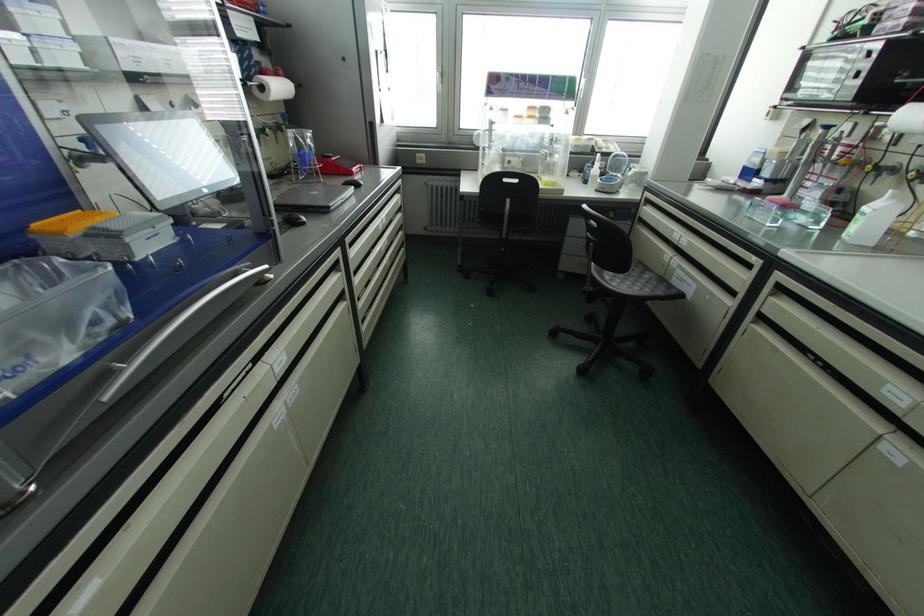
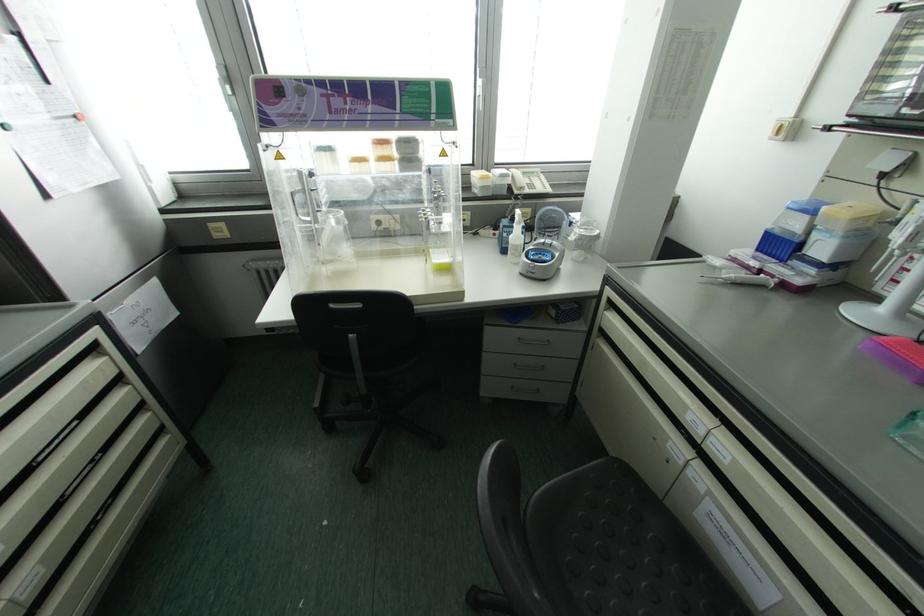
In the second image, find the point that corresponds to (x=639, y=262) in the first image.

(626, 474)